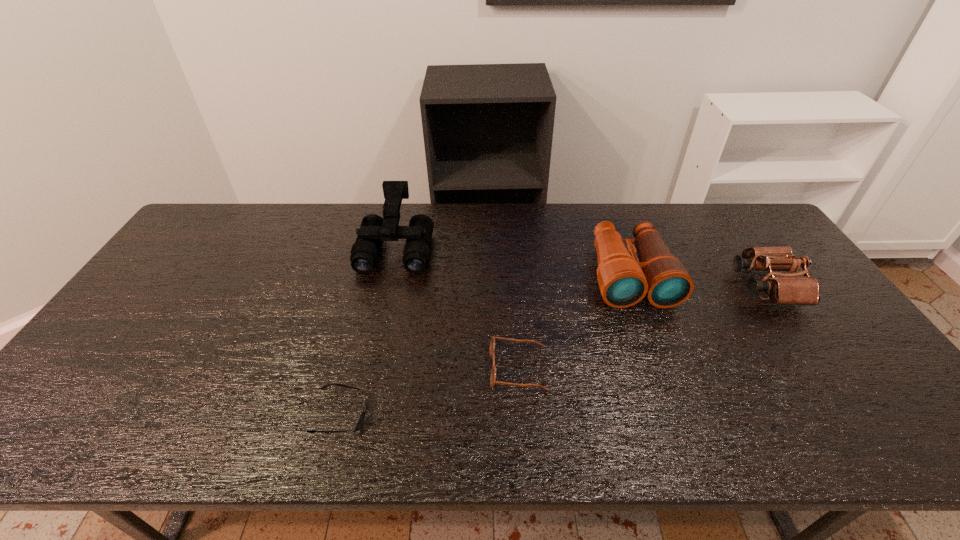
The width and height of the screenshot is (960, 540). I want to click on vacant point located 0.160m through the lenses of the second binoculars from left to right, so click(659, 355).

Locate an element on the screen. blank space located 0.210m through the eyepieces of the shortest binoculars is located at coordinates (668, 286).

Locate an element on the screen. The width and height of the screenshot is (960, 540). blank space located through the eyepieces of the shortest binoculars is located at coordinates (641, 286).

This screenshot has height=540, width=960. Find the location of `free space located 0.210m through the eyepieces of the shortest binoculars`. free space located 0.210m through the eyepieces of the shortest binoculars is located at coordinates (668, 286).

Locate an element on the screen. Image resolution: width=960 pixels, height=540 pixels. vacant area situated 0.190m on the front-facing side of the third object from right to left is located at coordinates (414, 368).

Locate an element on the screen. free spot located on the front-facing side of the third object from right to left is located at coordinates (442, 368).

The height and width of the screenshot is (540, 960). Identify the location of vacant space located 0.350m on the front-facing side of the third object from right to left. (349, 368).

Identify the location of free space located on the lenses of the shortest object. (434, 415).

Locate an element on the screen. The width and height of the screenshot is (960, 540). object that is positioned at the far edge is located at coordinates (374, 229).

Where is `object positioned at the near edge`? The image size is (960, 540). object positioned at the near edge is located at coordinates (361, 419).